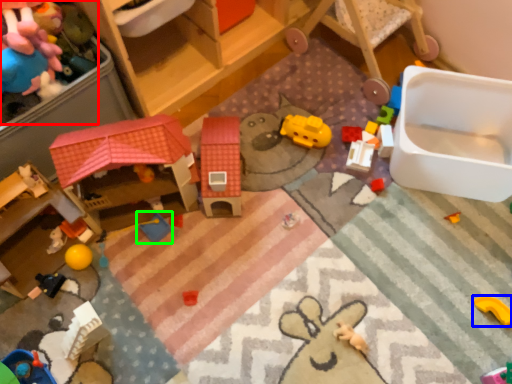
Question: Which is nearer to the toy (highlighted by a red box)? toy (highlighted by a blue box) or toy (highlighted by a green box).

Choices:
 (A) toy
 (B) toy

Answer: (B)